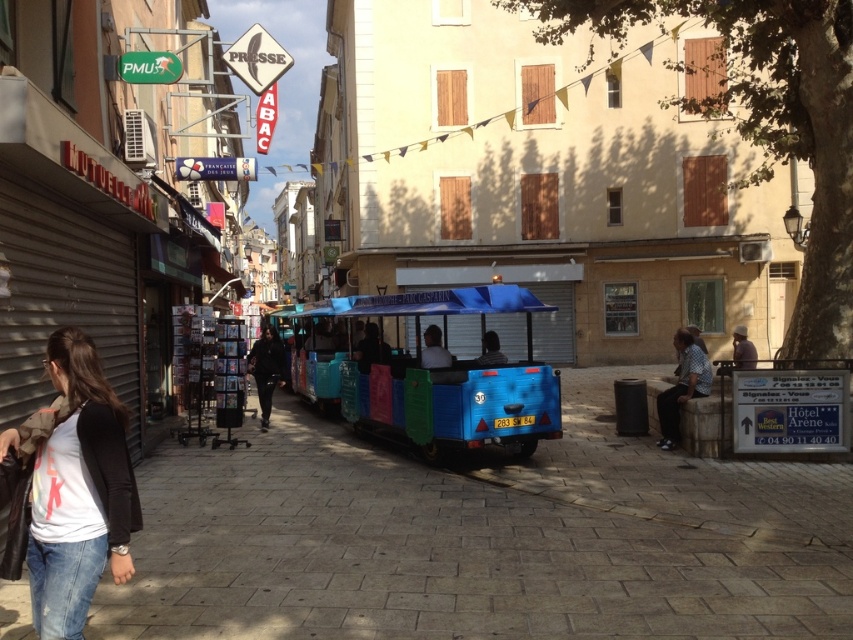
Question: Among these objects, which one is farthest from the camera?

Choices:
 (A) white matte shirt at lower left
 (B) light blue fabric trolley at center
 (C) patterned fabric shirt at center

Answer: (C)

Question: Among these objects, which one is farthest from the camera?

Choices:
 (A) patterned fabric shirt at center
 (B) smooth stone pavement at center
 (C) dark blue fabric train car at center
 (D) light blue fabric trolley at center

Answer: (C)

Question: Is white matte shirt at lower left to the right of light brown wooden bench at lower right from the viewer's perspective?

Choices:
 (A) yes
 (B) no

Answer: (B)

Question: Which point is closer to the camera?

Choices:
 (A) (21, 545)
 (B) (693, 356)
 (C) (36, 621)
 (D) (260, 372)

Answer: (A)

Question: From the image, what is the correct spatial relationship of patterned fabric shirt at center in relation to black matte jacket at center?

Choices:
 (A) below
 (B) above

Answer: (A)

Question: Is denim at lower left bigger than dark blue fabric train car at center?

Choices:
 (A) yes
 (B) no

Answer: (A)